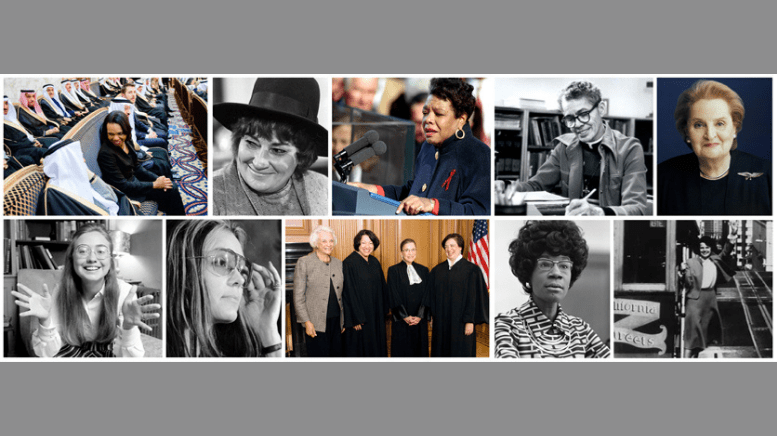
In order to click on benches in this screenshot , I will do 26,187, 89,134, 197,119, 175,102.